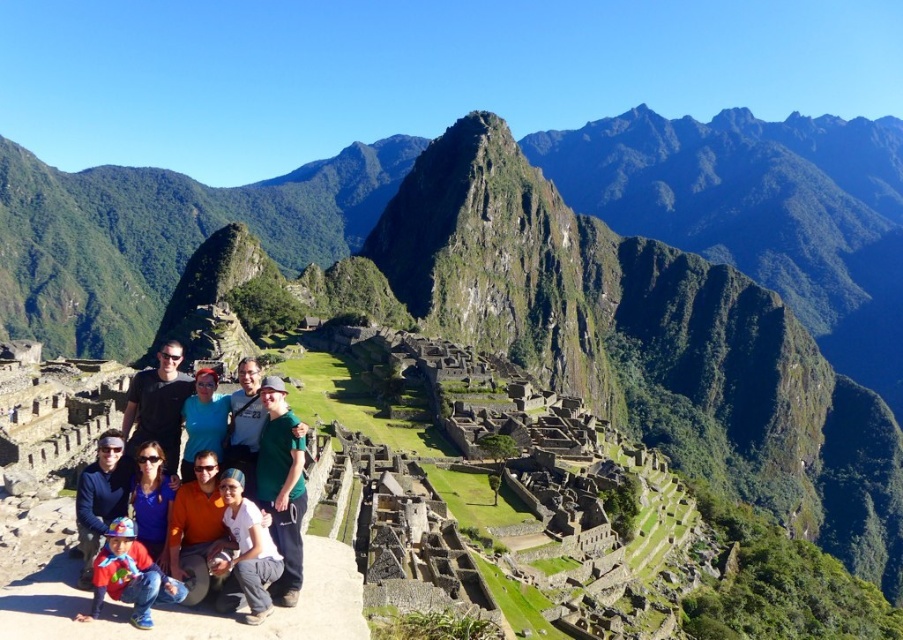
You are standing at the Machu Picchu archaeological site and see two points marked in the image. The first point is at coordinates point (82, 552) and the second point is at point (244, 522). Which of these two points is located closer to your current position?

Point (82, 552) is closer to the viewer than point (244, 522), so the first point is closer to your current position.

In the photo taken at Machu Picchu, there are two notable items of clothing visible. The multicolored clothing at center and the white cotton shirt at lower center. From the perspective of someone standing at the back of the group, which clothing item is positioned to the left?

The multicolored clothing at center is positioned to the left of the white cotton shirt at lower center.

You are a photographer at Machu Picchu and need to ensure all subjects are visible in the photo. The matte red shirt at lower left and the blue cotton shirt at lower left are both in the lower left area. Which one is positioned lower and might be more likely to block the view of the ruins behind?

The matte red shirt at lower left is below the blue cotton shirt at lower left, so it is positioned lower and might be more likely to block the view of the ruins behind.